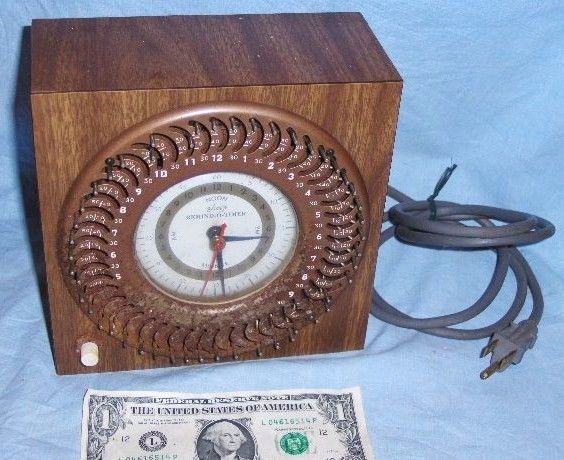
At what (x,y) coordinates should I click in order to perform the action: click on short black clock arm. Please return your answer as a coordinate pair (x, y). Looking at the image, I should click on (233, 237).